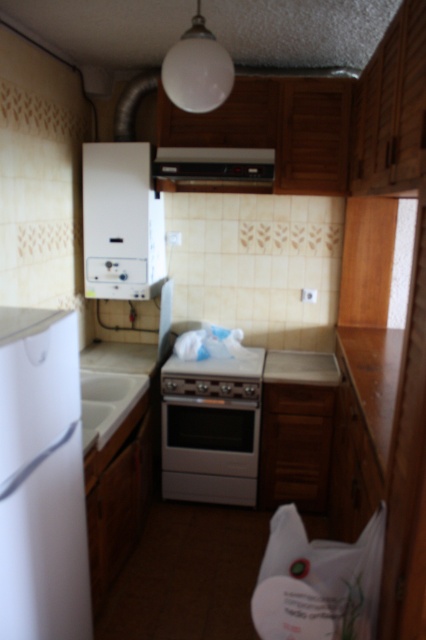
You are a delivery person trying to deliver a new microwave that requires 1.5 meters of space between the refrigerator and the oven to be installed. Based on the scene described, can you install the microwave between the white matte refrigerator at left and the white glossy oven at center?

The distance between the white matte refrigerator at left and the white glossy oven at center is 1.38 meters, which is less than the required 1.5 meters. Therefore, the microwave cannot be installed between them due to insufficient space.

You are standing in the kitchen and want to reach both the point at coordinates (x=106, y=152) and the point at coordinates (x=249, y=180). Which point will you need to move closer to first?

The point at coordinates (x=106, y=152) is closer to you than the point at coordinates (x=249, y=180) because it is further to the viewer. Therefore, you should move closer to the point at coordinates (x=106, y=152) first.